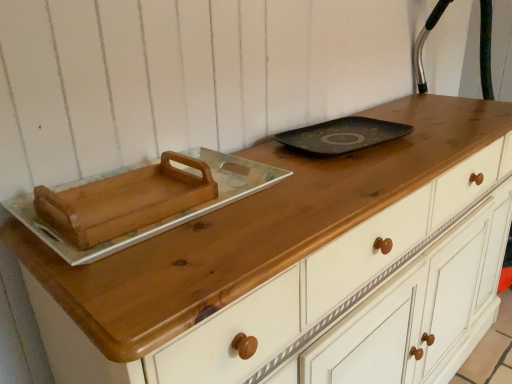
Measure the distance between black matte tray at center and camera.

black matte tray at center and camera are 3.44 feet apart.

This screenshot has width=512, height=384. What do you see at coordinates (342, 135) in the screenshot?
I see `black matte tray at center` at bounding box center [342, 135].

In order to face black matte tray at center, should I rotate leftwards or rightwards?

It's best to rotate right around 11.716 degrees.

This screenshot has width=512, height=384. Identify the location of black matte tray at center. (342, 135).

In order to face wooden tray at left, should I rotate leftwards or rightwards?

You should look left and rotate roughly 17.273 degrees.

Image resolution: width=512 pixels, height=384 pixels. What are the coordinates of `wooden tray at left` in the screenshot? It's located at (125, 201).

The image size is (512, 384). Describe the element at coordinates (125, 201) in the screenshot. I see `wooden tray at left` at that location.

Locate an element on the screen. The image size is (512, 384). black matte tray at center is located at coordinates (342, 135).

Can you confirm if black matte tray at center is positioned to the left of wooden tray at left?

No, black matte tray at center is not to the left of wooden tray at left.

From the picture: Which object is closer to the camera, black matte tray at center or wooden tray at left?

wooden tray at left.

Between point (380, 120) and point (52, 218), which one is positioned in front?

Point (52, 218)

Consider the image. From the image's perspective, which object appears higher, black matte tray at center or wooden tray at left?

From the image's view, black matte tray at center is above.

From a real-world perspective, is black matte tray at center over wooden tray at left?

No.

Does black matte tray at center have a greater width compared to wooden tray at left?

Yes, black matte tray at center is wider than wooden tray at left.

Which of these two, black matte tray at center or wooden tray at left, stands shorter?

black matte tray at center.

Who is bigger, black matte tray at center or wooden tray at left?

wooden tray at left.

Is wooden tray at left located within black matte tray at center?

No, wooden tray at left is not a part of black matte tray at center.

Is black matte tray at center next to wooden tray at left and touching it?

No, black matte tray at center is not in contact with wooden tray at left.

Could you tell me if black matte tray at center is facing wooden tray at left?

No.

Can you tell me how much black matte tray at center and wooden tray at left differ in facing direction?

1.61 degrees separate the facing orientations of black matte tray at center and wooden tray at left.

Locate an element on the screen. frying pan below the wooden tray at left (from a real-world perspective) is located at coordinates (342, 135).

Visually, is wooden tray at left positioned to the left or to the right of black matte tray at center?

In the image, wooden tray at left appears on the left side of black matte tray at center.

In the image, is wooden tray at left positioned in front of or behind black matte tray at center?

wooden tray at left is positioned closer to the viewer than black matte tray at center.

Does point (154, 168) come closer to viewer compared to point (293, 142)?

Yes, it is in front of point (293, 142).

From the image's perspective, is wooden tray at left positioned above or below black matte tray at center?

wooden tray at left is situated lower than black matte tray at center in the image.

From a real-world perspective, is wooden tray at left physically above black matte tray at center?

Yes, from a real-world perspective, wooden tray at left is on top of black matte tray at center.

Looking at their sizes, would you say wooden tray at left is wider or thinner than black matte tray at center?

In the image, wooden tray at left appears to be more narrow than black matte tray at center.

Which of these two, wooden tray at left or black matte tray at center, stands shorter?

black matte tray at center.

Consider the image. Between wooden tray at left and black matte tray at center, which one has larger size?

Bigger between the two is wooden tray at left.

Is wooden tray at left situated inside black matte tray at center or outside?

wooden tray at left lies outside black matte tray at center.

Can you see wooden tray at left touching black matte tray at center?

wooden tray at left is not next to black matte tray at center, and they're not touching.

Does wooden tray at left turn towards black matte tray at center?

No, wooden tray at left is not aimed at black matte tray at center.

Can you tell me how much wooden tray at left and black matte tray at center differ in facing direction?

1.61 degrees.

Where is `food lying on the left of black matte tray at center`? The image size is (512, 384). food lying on the left of black matte tray at center is located at coordinates (125, 201).

In order to click on food lying in front of the black matte tray at center in this screenshot , I will do `click(125, 201)`.

In the image, there is a wooden tray at left. In order to click on frying pan above it (from the image's perspective) in this screenshot , I will do `click(342, 135)`.